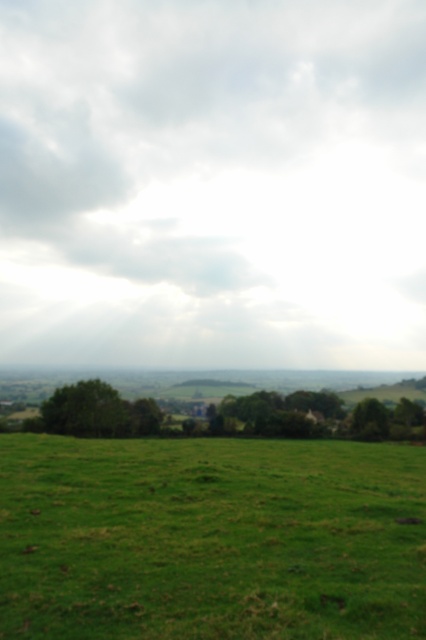
Question: Which object is closer to the camera taking this photo?

Choices:
 (A) green grass at lower center
 (B) white fluffy cloud at upper center

Answer: (A)

Question: Is white fluffy cloud at upper center wider than green grass at lower center?

Choices:
 (A) yes
 (B) no

Answer: (A)

Question: Is white fluffy cloud at upper center wider than green grass at lower center?

Choices:
 (A) yes
 (B) no

Answer: (A)

Question: Which point appears closest to the camera in this image?

Choices:
 (A) (362, 138)
 (B) (144, 621)

Answer: (B)

Question: Which object appears farthest from the camera in this image?

Choices:
 (A) white fluffy cloud at upper center
 (B) green grass at lower center

Answer: (A)

Question: Is white fluffy cloud at upper center bigger than green grass at lower center?

Choices:
 (A) no
 (B) yes

Answer: (B)